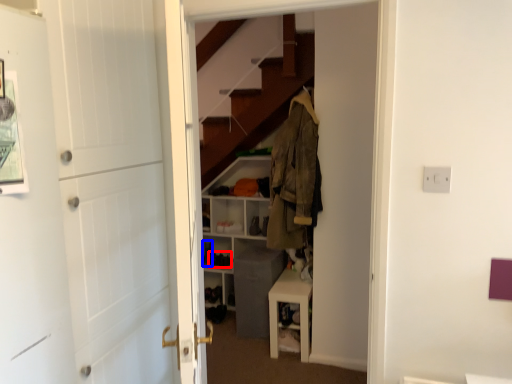
Question: Which object appears farthest to the camera in this image, shoe (highlighted by a red box) or shoe (highlighted by a blue box)?

Choices:
 (A) shoe
 (B) shoe

Answer: (B)